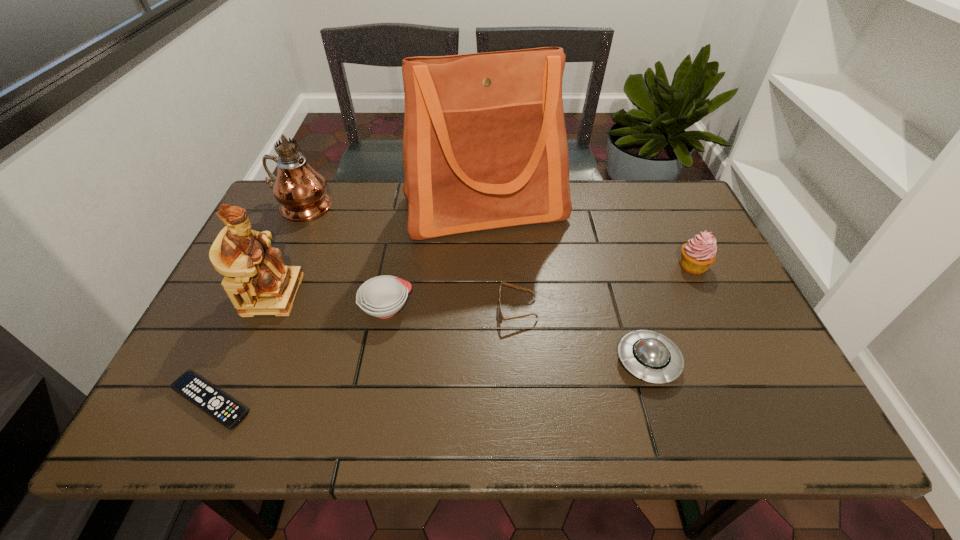
Identify the location of oil lamp located in the far edge section of the desktop. (301, 191).

Where is `object positioned at the near edge`? object positioned at the near edge is located at coordinates (228, 412).

Where is `oil lamp that is positioned at the left edge`? The width and height of the screenshot is (960, 540). oil lamp that is positioned at the left edge is located at coordinates (301, 191).

The width and height of the screenshot is (960, 540). I want to click on figurine positioned at the left edge, so click(x=257, y=282).

Identify the location of remote control that is at the left edge. The height and width of the screenshot is (540, 960). (228, 412).

Locate an element on the screen. This screenshot has height=540, width=960. object that is at the right edge is located at coordinates (699, 253).

Image resolution: width=960 pixels, height=540 pixels. I want to click on object present at the far left corner, so click(x=301, y=191).

Identify the location of object that is at the near left corner. click(228, 412).

In the image, there is a desktop. At what (x,y) coordinates should I click in order to perform the action: click on free space at the far edge. Please return your answer as a coordinate pair (x, y). The image size is (960, 540). Looking at the image, I should click on (590, 181).

I want to click on free region at the near edge of the desktop, so click(x=671, y=426).